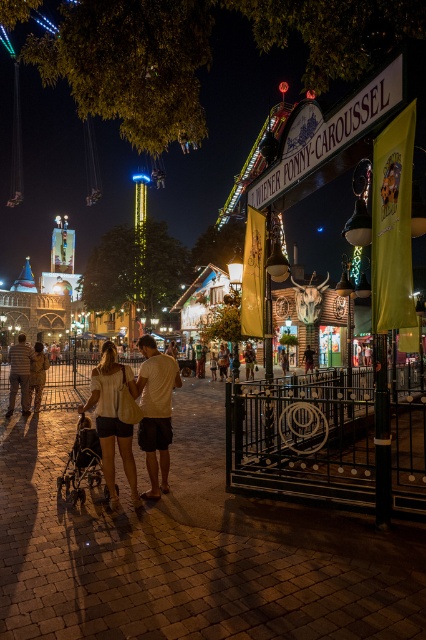
Question: Considering the real-world distances, which object is closest to the light brown leather shorts at center?

Choices:
 (A) matte black stroller at lower left
 (B) light beige cotton shirt at center
 (C) striped shirt at lower left
 (D) light beige shorts at center

Answer: (C)

Question: Does light beige shorts at center have a smaller size compared to light brown leather shorts at center?

Choices:
 (A) no
 (B) yes

Answer: (A)

Question: Can you confirm if light beige cotton shirt at center is positioned to the left of striped shirt at lower left?

Choices:
 (A) yes
 (B) no

Answer: (B)

Question: Does light beige cotton shirt at center appear under matte black stroller at lower left?

Choices:
 (A) no
 (B) yes

Answer: (A)

Question: Which point is farther to the camera?

Choices:
 (A) striped shirt at lower left
 (B) light brown leather shorts at center

Answer: (B)

Question: Which of these objects is positioned closest to the light beige cotton shirt at center?

Choices:
 (A) light beige shorts at center
 (B) light brown leather shorts at center
 (C) striped shirt at lower left
 (D) matte black stroller at lower left

Answer: (A)